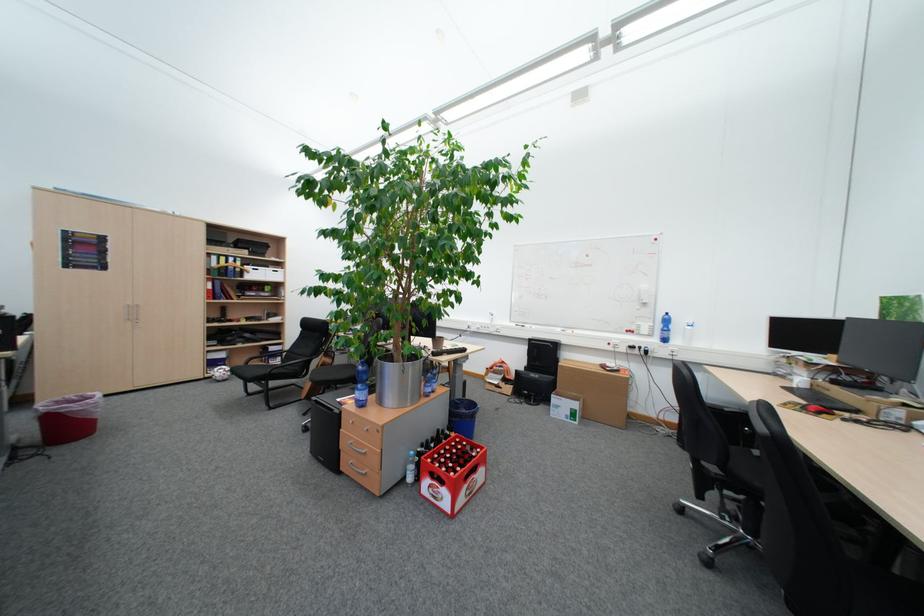
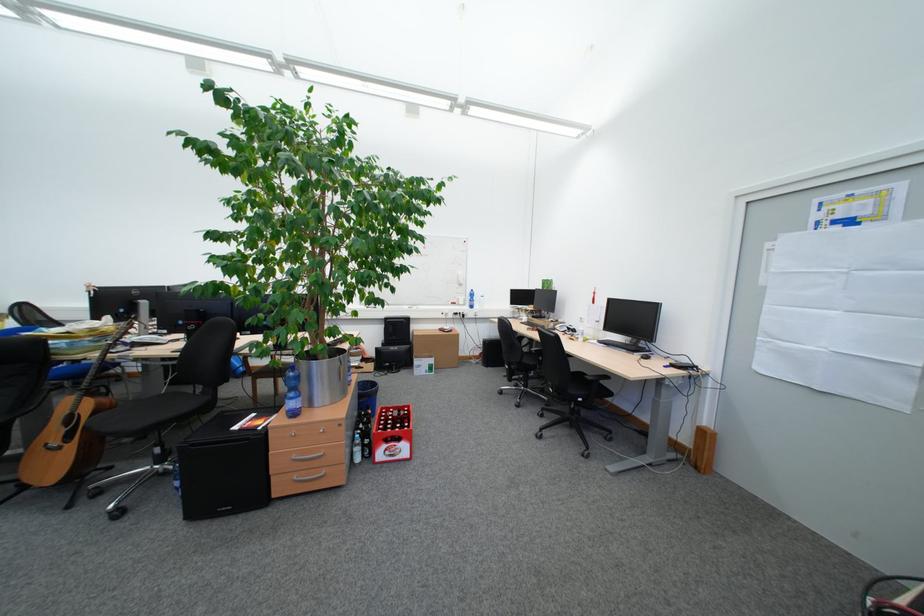
In the second image, find the point that corresponds to point 588,406 in the first image.

(444, 362)